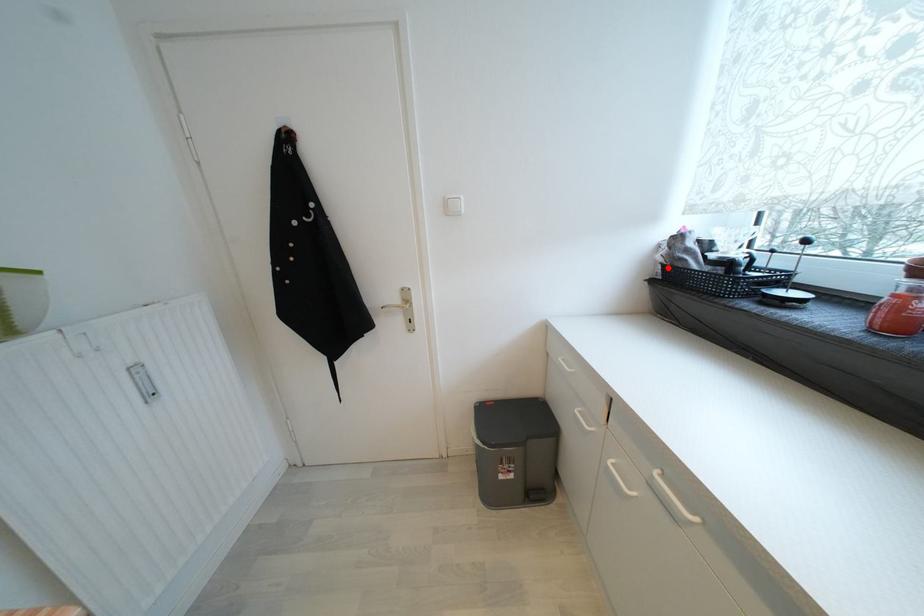
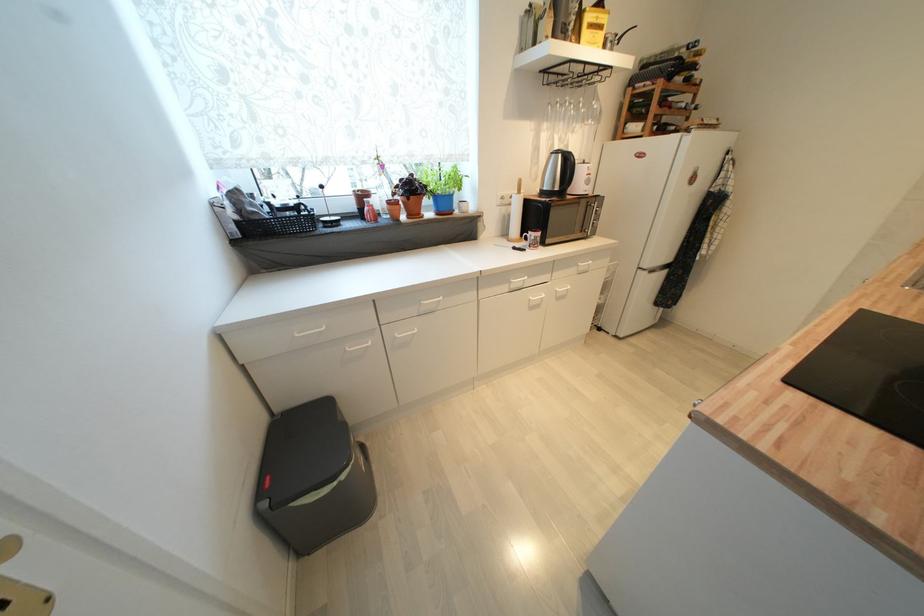
Question: I am providing you with two images of the same scene from different viewpoints. A red point is marked on the first image. Can you still see the location of the red point in image 2?

Choices:
 (A) Yes
 (B) No

Answer: (A)